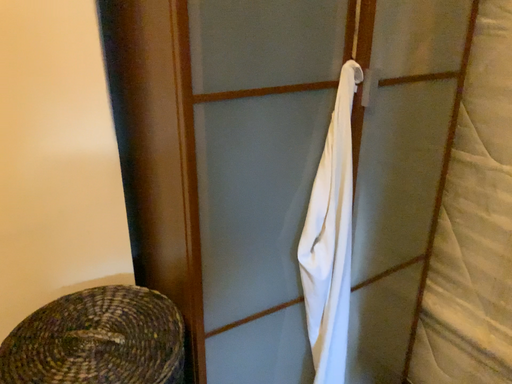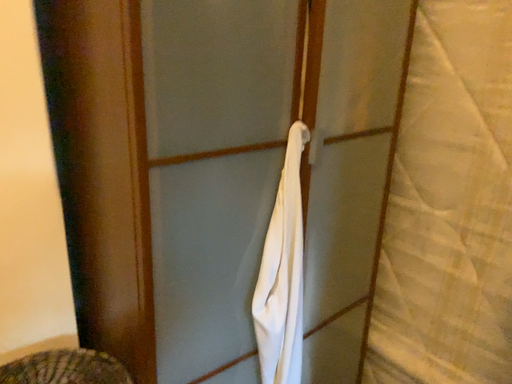
Question: Which way did the camera rotate in the video?

Choices:
 (A) rotated left
 (B) rotated right

Answer: (B)